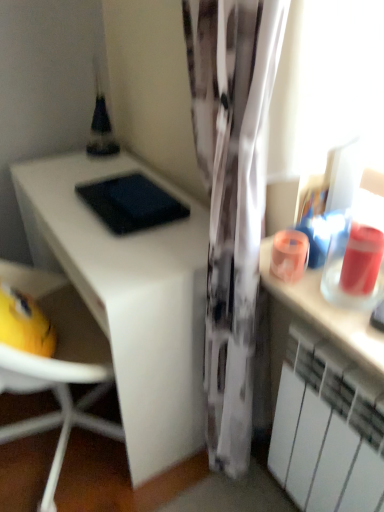
In the scene shown: What is the approximate height of white matte radiator at lower right?

white matte radiator at lower right is 23.04 inches in height.

At what (x,y) coordinates should I click in order to perform the action: click on white matte radiator at lower right. Please return your answer as a coordinate pair (x, y). Looking at the image, I should click on (327, 428).

This screenshot has width=384, height=512. What do you see at coordinates (327, 428) in the screenshot?
I see `white matte radiator at lower right` at bounding box center [327, 428].

Measure the distance between point (301, 352) and camera.

The distance of point (301, 352) from camera is 38.39 inches.

Describe the element at coordinates (130, 298) in the screenshot. Image resolution: width=384 pixels, height=512 pixels. I see `white matte desk at left` at that location.

The width and height of the screenshot is (384, 512). In order to click on white matte desk at left in this screenshot , I will do `click(130, 298)`.

Where is `white matte radiator at lower right`? The height and width of the screenshot is (512, 384). white matte radiator at lower right is located at coordinates (327, 428).

Which is more to the left, white matte desk at left or white matte radiator at lower right?

From the viewer's perspective, white matte desk at left appears more on the left side.

Looking at this image, which is behind, white matte desk at left or white matte radiator at lower right?

white matte desk at left.

Which point is more distant from viewer, (x=47, y=206) or (x=271, y=470)?

Point (x=47, y=206)

From the image's perspective, is white matte desk at left on white matte radiator at lower right?

Yes, from the image's perspective, white matte desk at left is on top of white matte radiator at lower right.

From a real-world perspective, which object rests below the other?

In real-world perspective, white matte desk at left is lower.

Between white matte desk at left and white matte radiator at lower right, which one has smaller width?

With smaller width is white matte radiator at lower right.

Considering the sizes of objects white matte desk at left and white matte radiator at lower right in the image provided, who is taller, white matte desk at left or white matte radiator at lower right?

white matte desk at left is taller.

Who is bigger, white matte desk at left or white matte radiator at lower right?

white matte desk at left is bigger.

Based on the photo, is white matte desk at left inside the boundaries of white matte radiator at lower right, or outside?

white matte desk at left is spatially situated outside white matte radiator at lower right.

Would you consider white matte desk at left to be distant from white matte radiator at lower right?

No, there isn't a large distance between white matte desk at left and white matte radiator at lower right.

Based on the photo, is white matte desk at left facing towards white matte radiator at lower right?

No, white matte desk at left is not aimed at white matte radiator at lower right.

How many degrees apart are the facing directions of white matte desk at left and white matte radiator at lower right?

The angle between the facing direction of white matte desk at left and the facing direction of white matte radiator at lower right is 177 degrees.

How much distance is there between white matte desk at left and white matte radiator at lower right?

white matte desk at left and white matte radiator at lower right are 17.82 inches apart.

There is a white matte desk at left. Identify the location of cabinetry above it (from a real-world perspective). (327, 428).

Which object is positioned more to the left, white matte radiator at lower right or white matte desk at left?

From the viewer's perspective, white matte desk at left appears more on the left side.

Is the position of white matte radiator at lower right less distant than that of white matte desk at left?

Yes, the depth of white matte radiator at lower right is less than that of white matte desk at left.

Does point (330, 386) come farther from viewer compared to point (100, 236)?

No.

From the image's perspective, does white matte radiator at lower right appear lower than white matte desk at left?

Yes.

From a real-world perspective, is white matte radiator at lower right located higher than white matte desk at left?

Yes, from a real-world perspective, white matte radiator at lower right is above white matte desk at left.

Is white matte radiator at lower right wider than white matte desk at left?

No.

Which of these two, white matte radiator at lower right or white matte desk at left, stands taller?

With more height is white matte desk at left.

Considering the relative sizes of white matte radiator at lower right and white matte desk at left in the image provided, is white matte radiator at lower right smaller than white matte desk at left?

Indeed, white matte radiator at lower right has a smaller size compared to white matte desk at left.

Is white matte radiator at lower right not inside white matte desk at left?

Yes, white matte radiator at lower right is located beyond the bounds of white matte desk at left.

Is white matte radiator at lower right positioned far away from white matte desk at left?

No, white matte radiator at lower right is not far from white matte desk at left.

Looking at this image, is white matte radiator at lower right facing towards white matte desk at left?

No, white matte radiator at lower right is not facing towards white matte desk at left.

Can you tell me how much white matte radiator at lower right and white matte desk at left differ in facing direction?

177 degrees.

The width and height of the screenshot is (384, 512). What are the coordinates of `cabinetry that is below the white matte desk at left (from the image's perspective)` in the screenshot? It's located at (327, 428).

Find the location of a particular element. This screenshot has width=384, height=512. cabinetry in front of the white matte desk at left is located at coordinates (327, 428).

At what (x,y) coordinates should I click in order to perform the action: click on cabinetry below the white matte desk at left (from the image's perspective). Please return your answer as a coordinate pair (x, y). The height and width of the screenshot is (512, 384). Looking at the image, I should click on (327, 428).